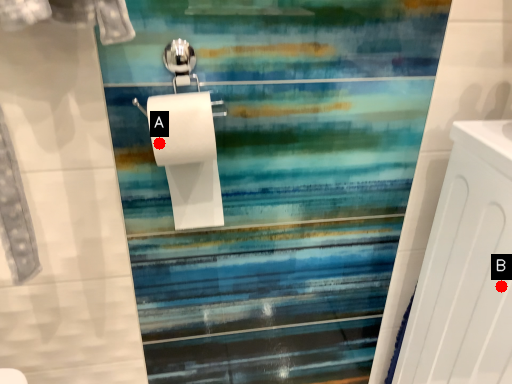
Question: Two points are circled on the image, labeled by A and B beside each circle. Which of the following is the closest to the observer?

Choices:
 (A) A is closer
 (B) B is closer

Answer: (A)